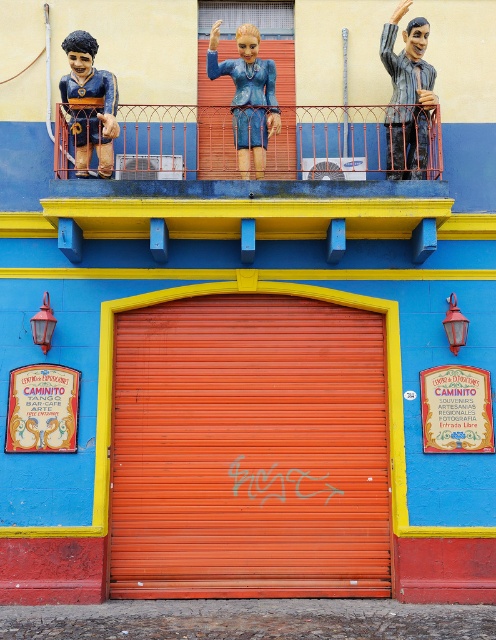
You are an architect designing a new building facade. You want to place a decorative element between the metallic red railing at upper center and the matte gray statue at upper right. Considering their widths, which object should the decorative element be placed closer to?

The decorative element should be placed closer to the metallic red railing at upper center because its width is larger than the matte gray statue at upper right.

You are a drone operator trying to capture a photo of the metallic red railing at upper center. The drone has a camera with a 1200mm focal length lens. The drone is currently at position point A, which is 10 meters away from the building. The building facade is 15 meters tall. The drone can only move horizontally to adjust its position. What is the minimum distance the drone must move horizontally to ensure the railing is centered in the photo?

The metallic red railing at upper center is located at point coordinates (251, 156). To center it in the photo with a 1200mm lens from 10 meters away, the drone must move horizontally to align the camera axis with the railing. The exact distance requires calculating the horizontal offset based on the coordinate system provided, but since the question specifies moving horizontally to center, the minimum distance is the horizontal difference from the current position to the railing position. However, the 0.

You are standing in front of the building and want to locate the metallic red railing at upper center. According to the coordinates provided, where exactly should you look?

The metallic red railing at upper center is located at coordinates point (x=251, y=156).